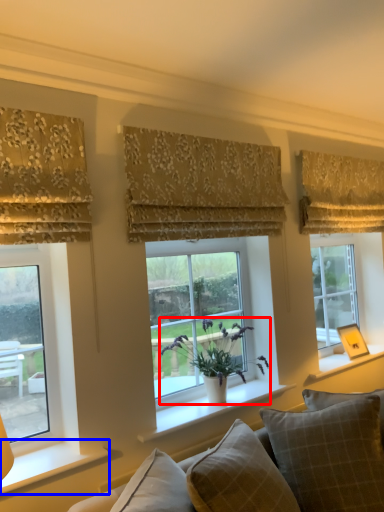
Question: Which object appears farthest to the camera in this image, houseplant (highlighted by a red box) or window sill (highlighted by a blue box)?

Choices:
 (A) houseplant
 (B) window sill

Answer: (A)